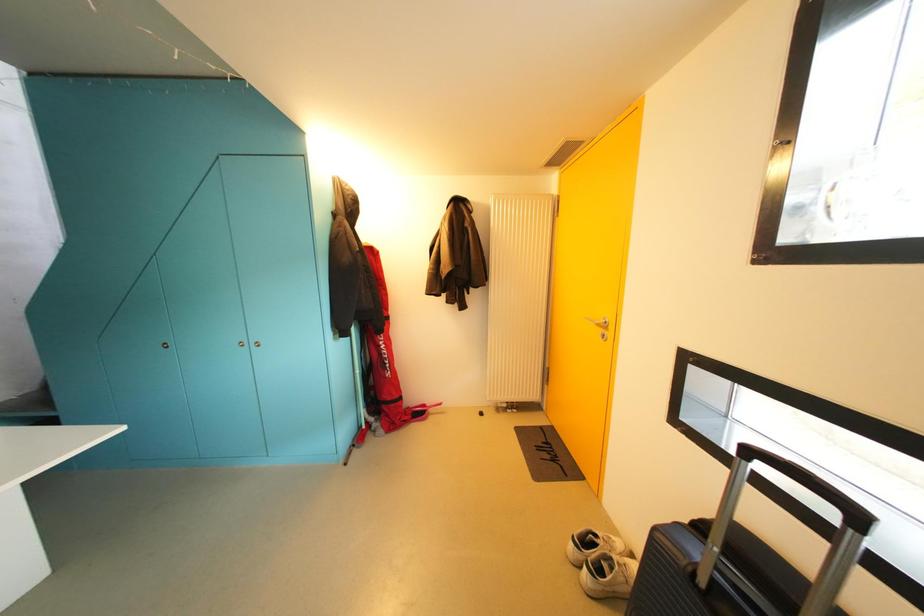
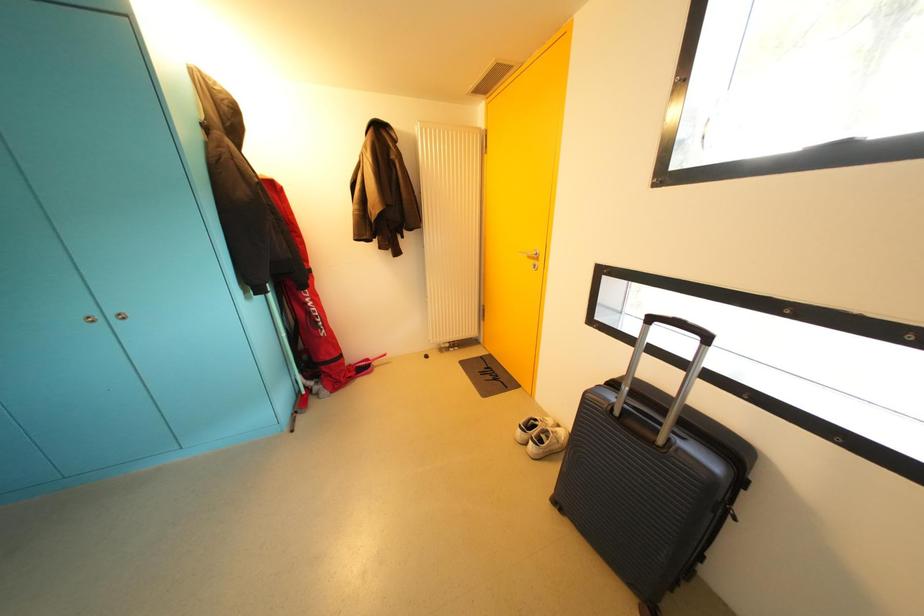
Question: The images are taken continuously from a first-person perspective. In which direction are you moving?

Choices:
 (A) Left
 (B) Right
 (C) Forward
 (D) Backward

Answer: (A)